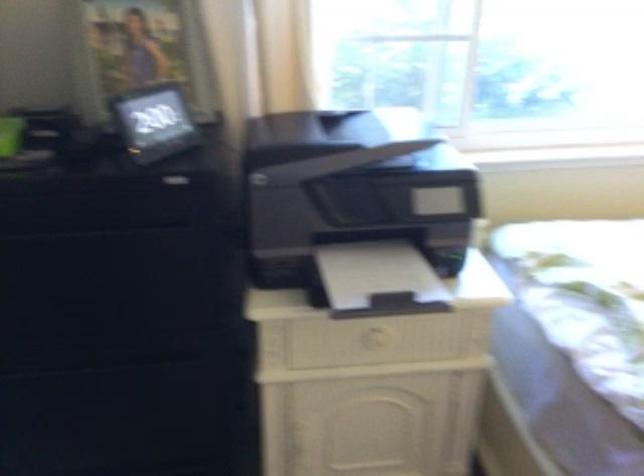
What do you see at coordinates (377, 128) in the screenshot?
I see `a printer scanner lid` at bounding box center [377, 128].